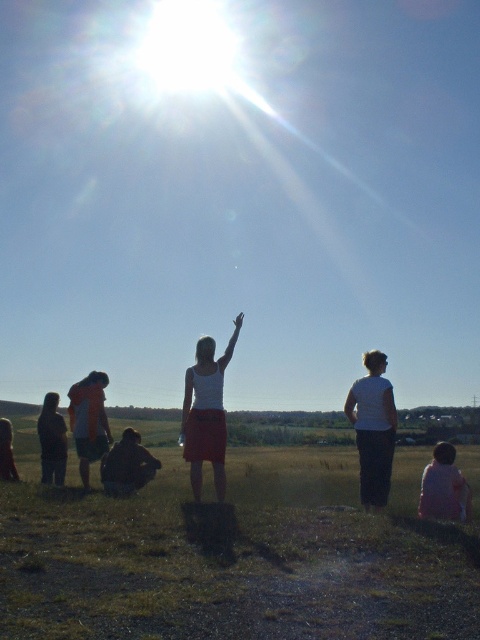
You are standing at the origin point of the coordinate system. You want to walk to the green grass at center. Which direction should you go?

The green grass at center is located at coordinate point 0.866 on the x axis and 0.485 on the y axis. Since you are at the origin, you should move towards the positive x and positive y direction to reach it.

You are a photographer trying to capture a photo of the white fabric skirt at center and the orange fabric shirt at left. Based on their sizes in the image, which one would appear closer to the camera?

The white fabric skirt at center appears closer to the camera because it has a smaller size compared to the orange fabric shirt at left, indicating it is farther away.

You are a photographer trying to capture a closeup of the dark brown fabric at lower left and the matte black jacket at lower left. Since you can only focus on one object at a time, which object should you choose to ensure it takes up more of the frame?

The matte black jacket at lower left occupies more space than the dark brown fabric at lower left, so you should focus on the matte black jacket at lower left to ensure it takes up more of the frame.